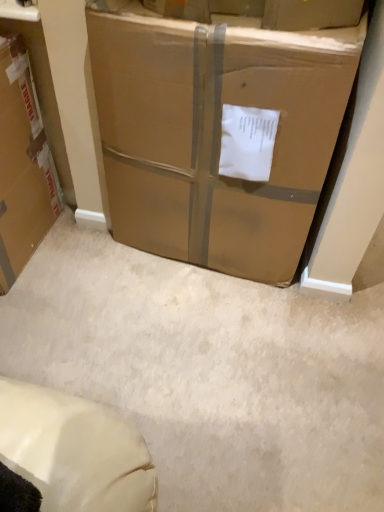
Where is `free space to the left of brown cardboard box at center, which is the 1th box in right-to-left order`? Image resolution: width=384 pixels, height=512 pixels. free space to the left of brown cardboard box at center, which is the 1th box in right-to-left order is located at coordinates (77, 275).